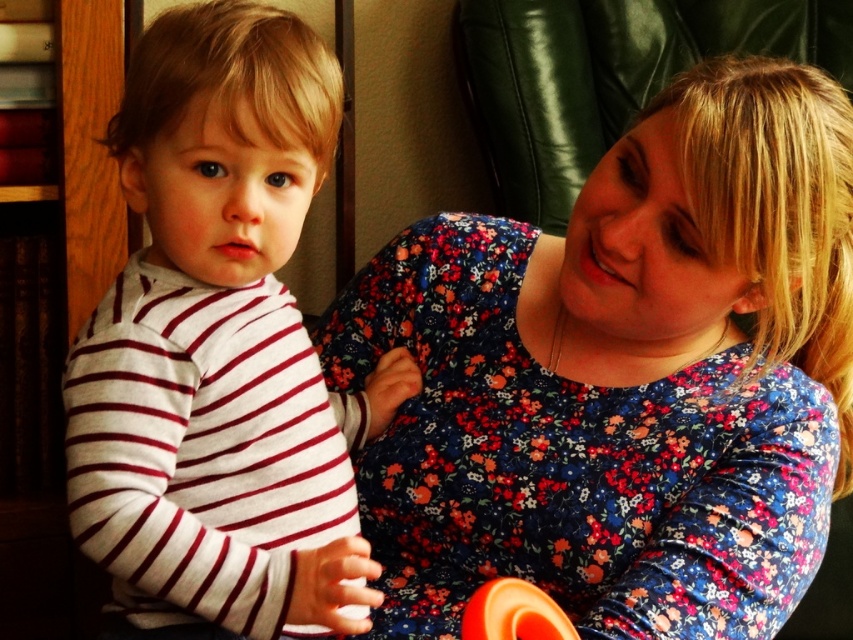
You are a photographer setting up a shoot in this scene. You need to place a small tripod between the white striped shirt at left and the orange rubber ring at lower center. Which object should the tripod be closer to to ensure it fits within the space?

The white striped shirt at left is wider than the orange rubber ring at lower center, so the tripod should be placed closer to the orange rubber ring at lower center to accommodate the space.

You are a photographer setting up for a family portrait. You need to ensure that the white striped shirt at left and the orange rubber ring at lower center are both visible in the frame. Given their sizes, which object should you focus on first to ensure proper composition?

The white striped shirt at left has a greater height compared to the orange rubber ring at lower center, so you should focus on the white striped shirt at left first to ensure it is properly framed before adjusting for the smaller orange rubber ring at lower center.